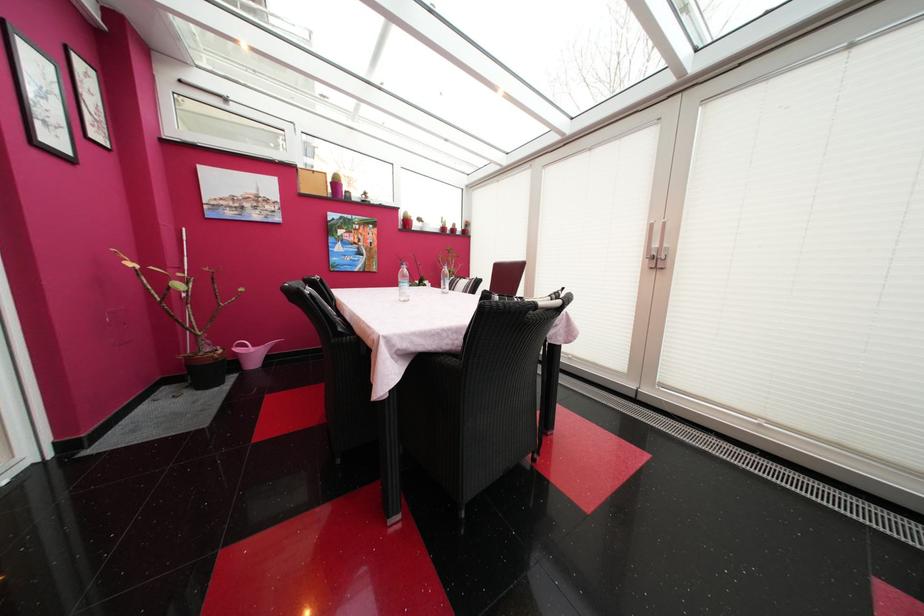
Image resolution: width=924 pixels, height=616 pixels. Describe the element at coordinates (205, 368) in the screenshot. I see `the small glass vase` at that location.